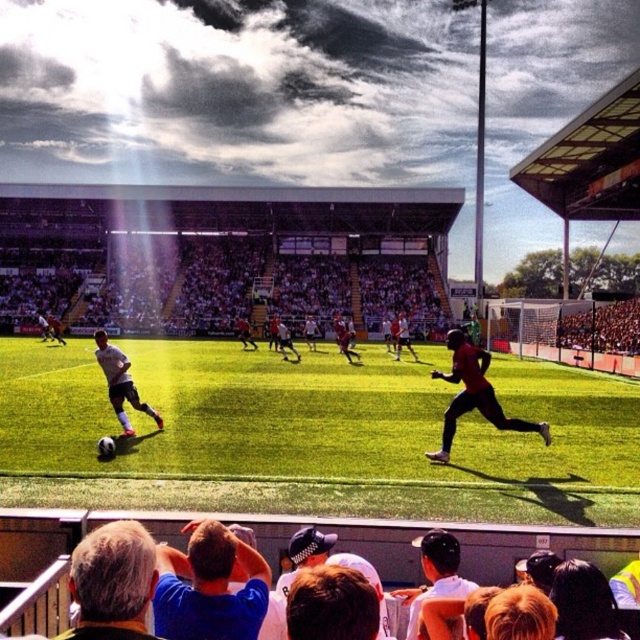
You are a photographer standing at the center of the soccer field. You want to take a photo of the blue shirt at lower center. Where should you point your camera?

You should point your camera at point (209, 586) to capture the blue shirt at lower center.

You are a soccer coach observing the match. You notice the blue shirt at lower center and the white matte soccer player at center. Which one is closer to the ground?

The blue shirt at lower center is shorter than the white matte soccer player at center, so it is closer to the ground.

You are a photographer trying to capture a photo of the blue shirt at lower center and gray hair at lower left. Which one is located to the right of the other?

The blue shirt at lower center is positioned on the right side of gray hair at lower left.